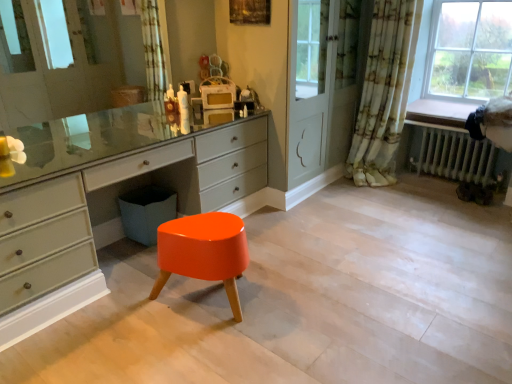
You are a GUI agent. You are given a task and a screenshot of the screen. Output one action in this format:
    pyautogui.click(x=<x>, y=<y>)
    Task: Click on the vacant area located to the right-hand side of glossy orange stool at center
    Image resolution: width=512 pixels, height=384 pixels.
    Given the screenshot: What is the action you would take?
    pyautogui.click(x=297, y=303)